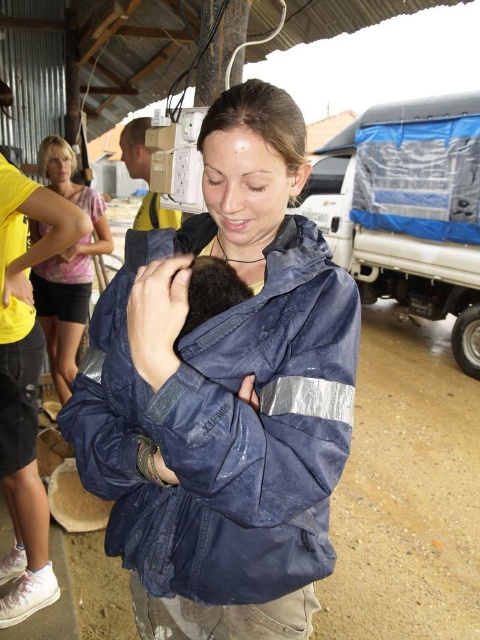
You are a photographer standing in the temporary shelter and you want to take a photo of both the navy blue jacket at center and the matte pink shirt at upper left. Which object should you focus on first if you want to capture both in the same frame?

The navy blue jacket at center is positioned on the right side of matte pink shirt at upper left, so you should focus on the matte pink shirt at upper left first to ensure both are in the frame.

You are a photographer standing at the camera position. You want to take a photo of the scene, but you need to ensure that the point at coordinates point (345, 422) is in focus. What is the minimum distance you need to adjust your focus to capture this point clearly?

The point at coordinates point (345, 422) is 31.33 inches away from the camera. Therefore, you need to adjust your focus to 31.33 inches to capture it clearly.